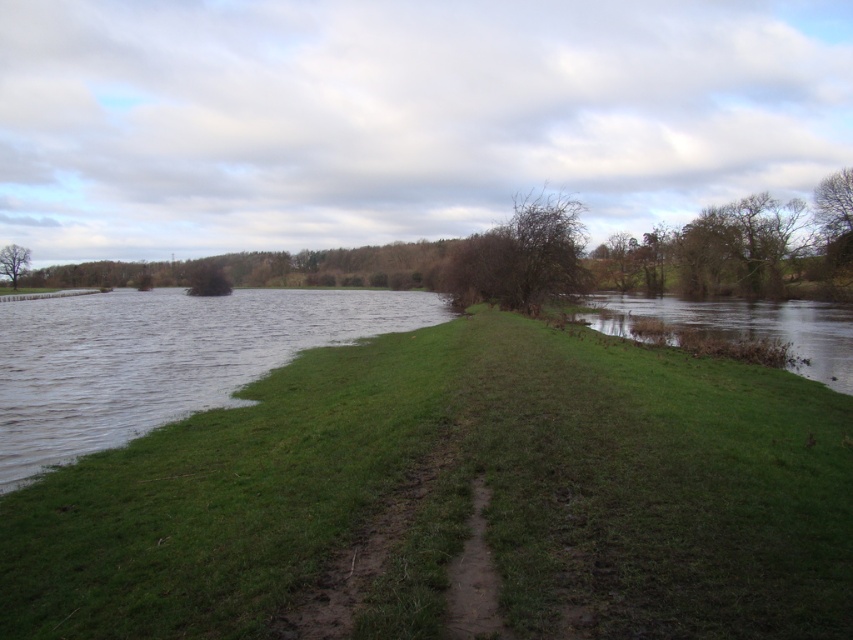
From the picture: Does green grassy at center appear over clear water at lower left?

Incorrect, green grassy at center is not positioned above clear water at lower left.

Does green grassy at center have a greater width compared to clear water at lower left?

In fact, green grassy at center might be narrower than clear water at lower left.

Which is behind, point (508, 515) or point (335, 314)?

Point (335, 314)

Where is `green grassy at center`? The image size is (853, 640). green grassy at center is located at coordinates (459, 497).

Is brown leafless tree at center in front of green leafy tree at left?

Yes, brown leafless tree at center is closer to the viewer.

Which is more to the left, brown leafless tree at center or green leafy tree at left?

green leafy tree at left is more to the left.

Locate an element on the screen. The width and height of the screenshot is (853, 640). brown leafless tree at center is located at coordinates (521, 257).

Which of these two, green grassy at center or green leafy tree at left, stands taller?

With more height is green leafy tree at left.

Consider the image. Who is more distant from viewer, (102, 573) or (9, 257)?

The point (9, 257) is more distant.

Identify the location of green grassy at center. The image size is (853, 640). (459, 497).